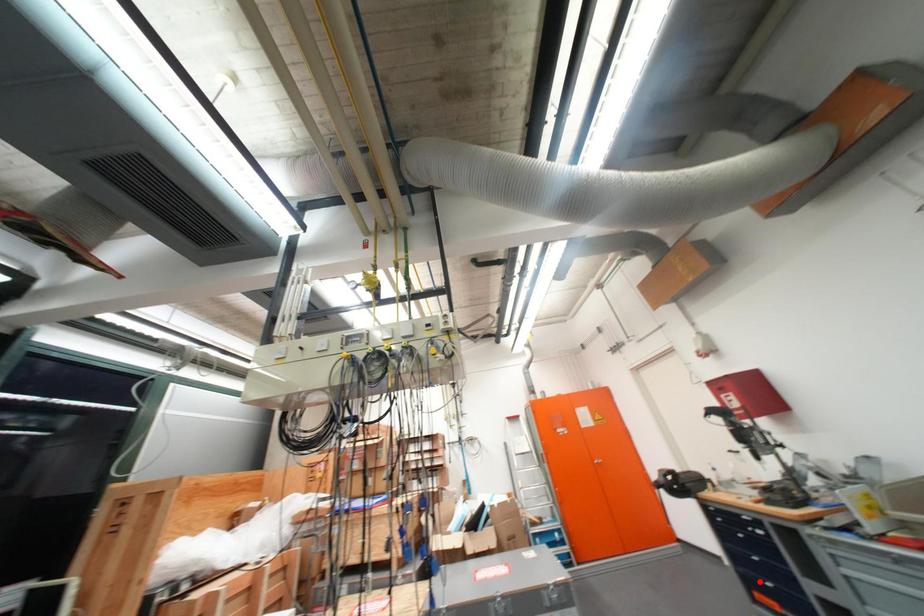
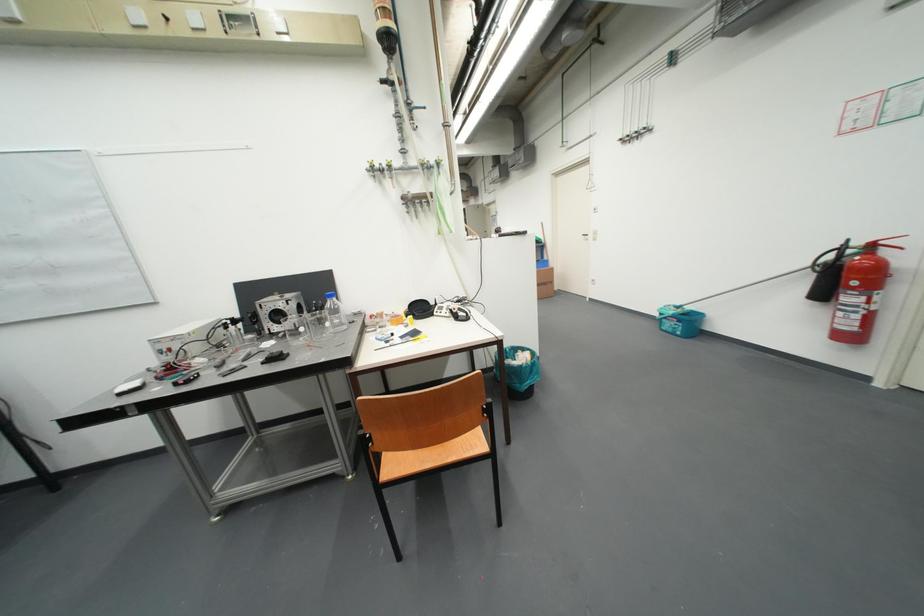
Question: I am providing you with two images of the same scene from different viewpoints. A red point is marked on the first image. Can you still see the location of the red point in image 2?

Choices:
 (A) Yes
 (B) No

Answer: (B)